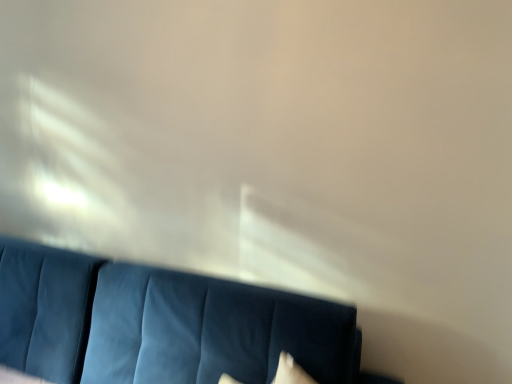
Locate an element on the screen. velvet blue headboard at center is located at coordinates (161, 324).

Image resolution: width=512 pixels, height=384 pixels. Describe the element at coordinates (161, 324) in the screenshot. I see `velvet blue headboard at center` at that location.

What is the approximate height of velvet blue headboard at center?

velvet blue headboard at center is 35.87 inches in height.

The width and height of the screenshot is (512, 384). I want to click on velvet blue headboard at center, so click(x=161, y=324).